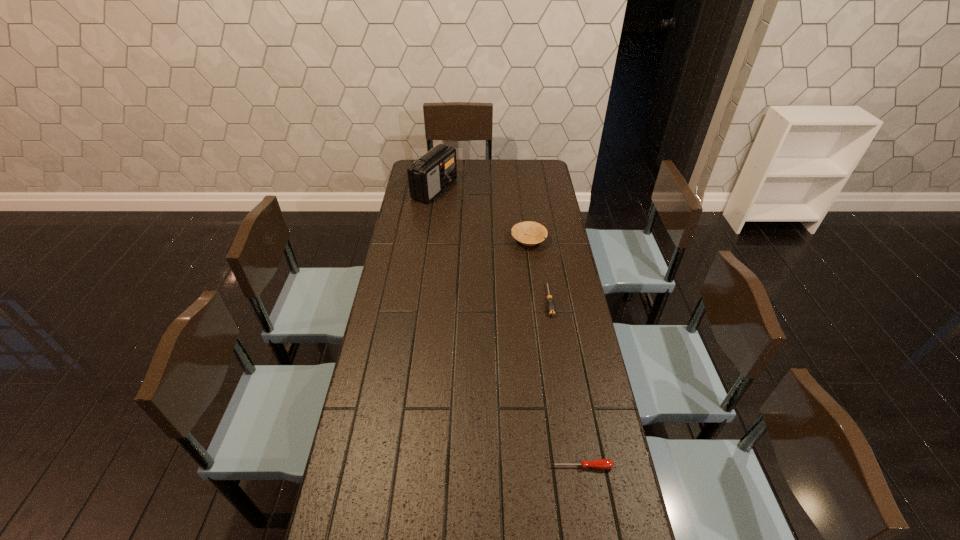
Identify the location of radio receiver. (428, 176).

In order to click on the leftmost object in this screenshot , I will do `click(428, 176)`.

Find the location of a particular element. the third shortest object is located at coordinates (535, 233).

Find the location of a particular element. The width and height of the screenshot is (960, 540). bowl is located at coordinates (535, 233).

The width and height of the screenshot is (960, 540). I want to click on the farther screwdriver, so 551,308.

In order to click on the nearer screwdriver in this screenshot , I will do `click(603, 464)`.

Locate an element on the screen. vacant space located on the front panel of the radio receiver is located at coordinates (481, 189).

Locate an element on the screen. This screenshot has width=960, height=540. free space located on the left of the bowl is located at coordinates (494, 240).

The height and width of the screenshot is (540, 960). In order to click on vacant space located 0.400m on the left of the third farthest object in this screenshot , I will do `click(436, 300)`.

Identify the location of vacant region located on the left of the nearest object. This screenshot has height=540, width=960. (519, 467).